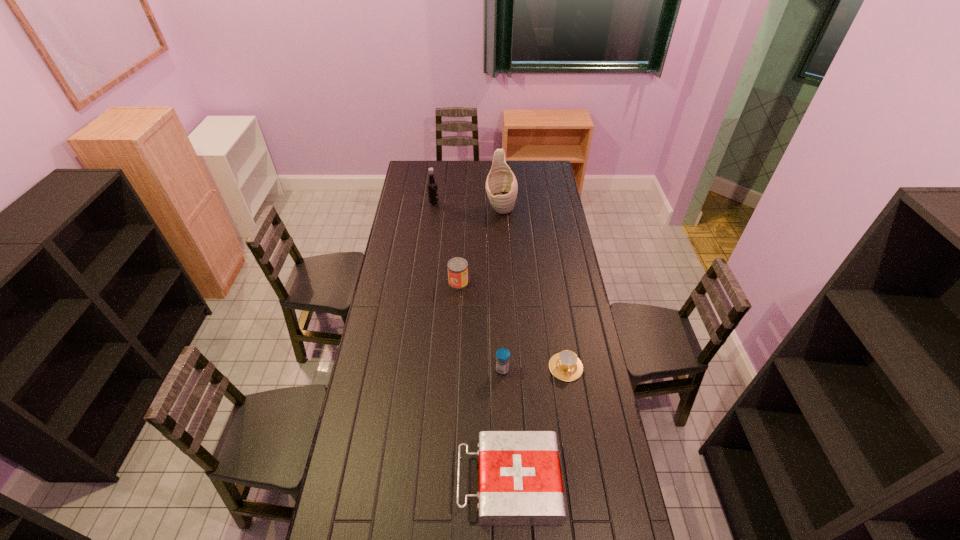
What are the coordinates of `the tallest object` in the screenshot? It's located at (501, 185).

Find the location of a particular element. The width and height of the screenshot is (960, 540). root beer is located at coordinates click(x=432, y=187).

Image resolution: width=960 pixels, height=540 pixels. Identify the location of the second tallest object. tap(432, 187).

I want to click on can, so click(457, 267).

At what (x,y) coordinates should I click in order to perform the action: click on medicine. Please return your answer as a coordinate pair (x, y). Image resolution: width=960 pixels, height=540 pixels. Looking at the image, I should click on (502, 355).

Locate an element on the screen. the second shortest object is located at coordinates (520, 482).

The height and width of the screenshot is (540, 960). I want to click on the nearest object, so click(520, 482).

At what (x,y) coordinates should I click in order to perform the action: click on the rightmost object. Please return your answer as a coordinate pair (x, y). Image resolution: width=960 pixels, height=540 pixels. Looking at the image, I should click on (566, 366).

Locate an element on the screen. This screenshot has width=960, height=540. the shortest object is located at coordinates (566, 366).

Where is `free location located 0.180m at the spout of the tallest object`? This screenshot has width=960, height=540. free location located 0.180m at the spout of the tallest object is located at coordinates (502, 240).